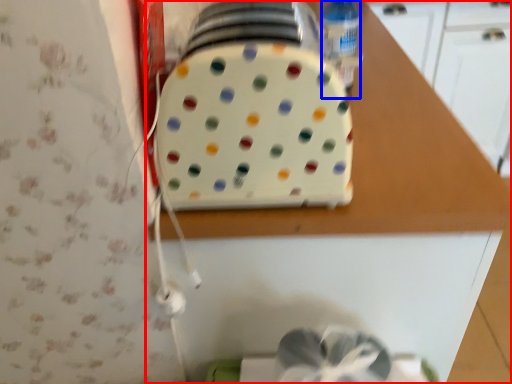
Question: Among these objects, which one is farthest to the camera, countertop (highlighted by a red box) or bottle (highlighted by a blue box)?

Choices:
 (A) countertop
 (B) bottle

Answer: (B)